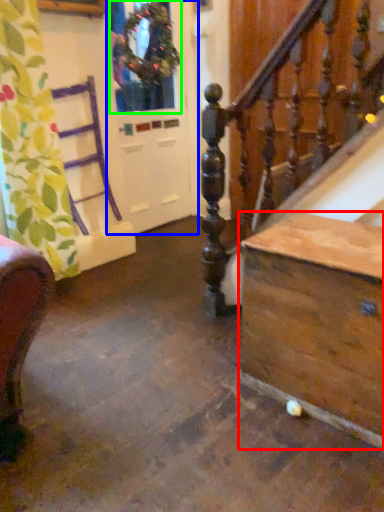
Question: Considering the real-world distances, which object is closest to table (highlighted by a red box)? screen door (highlighted by a blue box) or window (highlighted by a green box).

Choices:
 (A) screen door
 (B) window

Answer: (A)